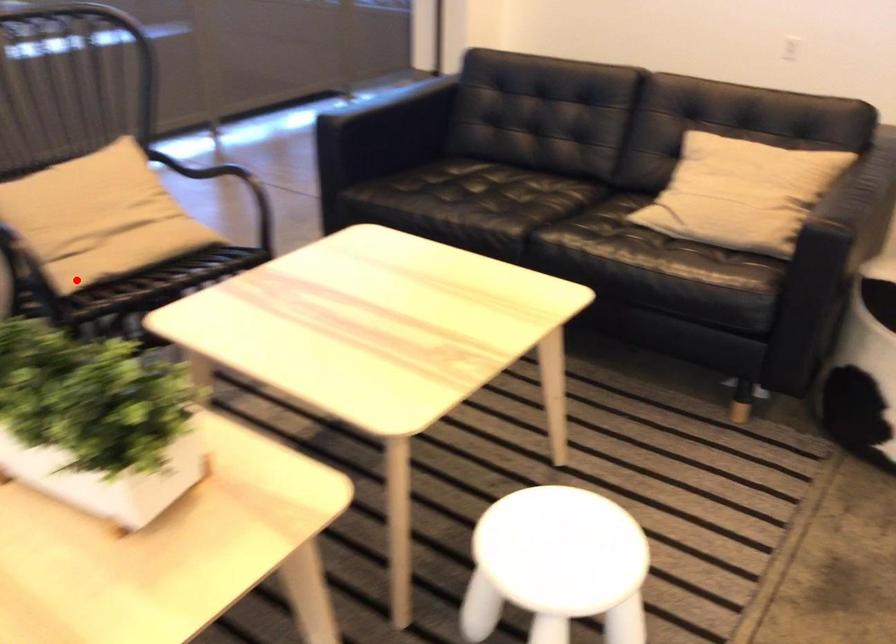
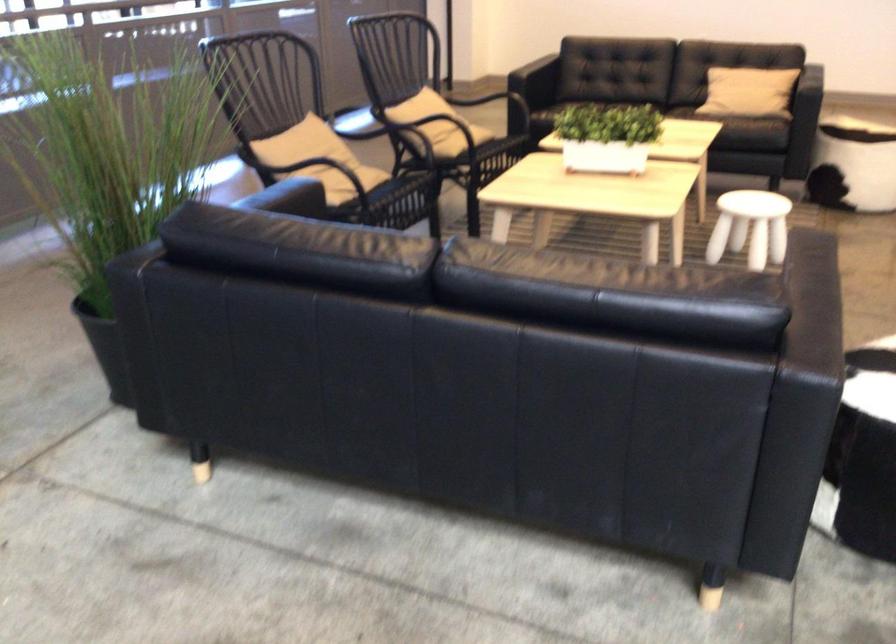
Where in the second image is the point corresponding to the highlighted location from the first image?

(462, 140)